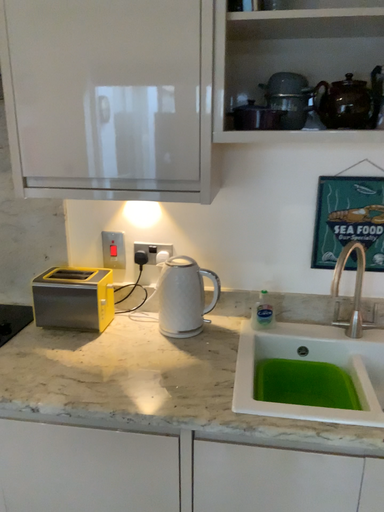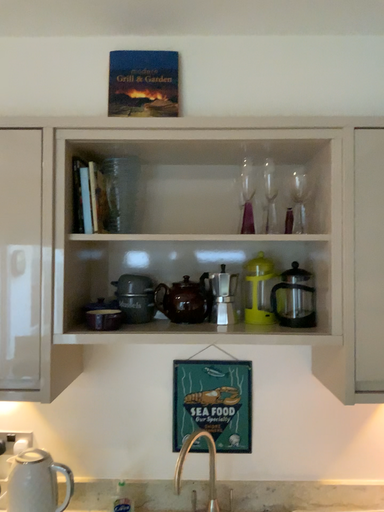
Question: How did the camera likely rotate when shooting the video?

Choices:
 (A) rotated downward
 (B) rotated upward

Answer: (B)